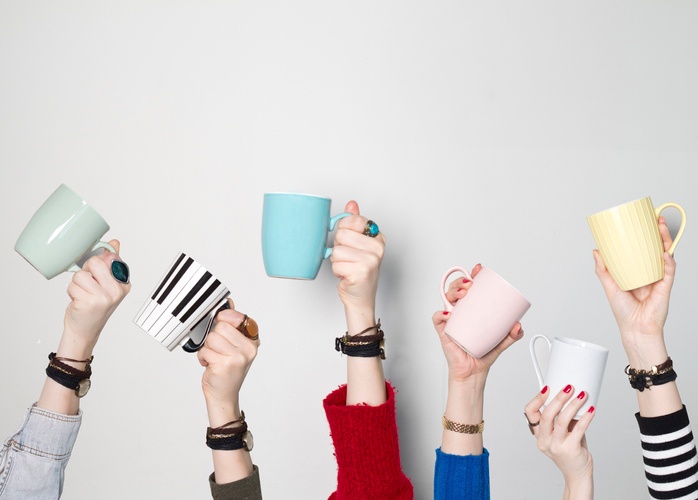
This screenshot has width=698, height=500. In order to click on handle in this screenshot , I will do `click(101, 250)`, `click(202, 352)`, `click(329, 234)`, `click(450, 288)`, `click(535, 358)`, `click(668, 218)`.